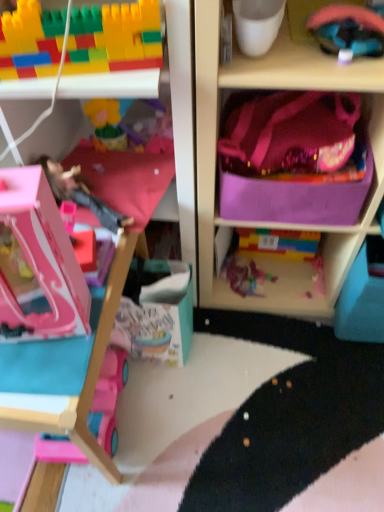
The height and width of the screenshot is (512, 384). What do you see at coordinates (42, 257) in the screenshot?
I see `pink plastic dollhouse at left` at bounding box center [42, 257].

At what (x,y) coordinates should I click in order to perform the action: click on purple fabric storage box at upper right. Please return your answer as a coordinate pair (x, y). Looking at the image, I should click on (299, 194).

What do you see at coordinates (244, 276) in the screenshot? The image size is (384, 512). I see `translucent plastic toy at center, acting as the second toy starting from the bottom` at bounding box center [244, 276].

Measure the distance between purple fabric bag at upper right and camera.

25.90 inches.

Locate an element on the screen. This screenshot has height=512, width=384. pink plastic dollhouse at left is located at coordinates (42, 257).

From the picture: Which object is positioned more to the right, purple fabric storage box at upper right or pink plastic toy car at lower left, the first toy positioned from the bottom?

From the viewer's perspective, purple fabric storage box at upper right appears more on the right side.

Is purple fabric storage box at upper right far away from pink plastic toy car at lower left, the first toy positioned from the bottom?

No, purple fabric storage box at upper right is in close proximity to pink plastic toy car at lower left, the first toy positioned from the bottom.

How far apart are purple fabric storage box at upper right and pink plastic toy car at lower left, the first toy positioned from the bottom?

57.99 centimeters.

Is purple fabric storage box at upper right aimed at pink plastic toy car at lower left, the first toy positioned from the bottom?

No, purple fabric storage box at upper right is not aimed at pink plastic toy car at lower left, the first toy positioned from the bottom.

From a real-world perspective, between white matte cup at upper center and multicolored plastic blocks at upper left, which is the second toy in top-to-bottom order, who is vertically lower?

In real-world perspective, white matte cup at upper center is lower.

Is white matte cup at upper center outside of multicolored plastic blocks at upper left, which is the second toy in top-to-bottom order?

Yes, white matte cup at upper center is located beyond the bounds of multicolored plastic blocks at upper left, which is the second toy in top-to-bottom order.

Is the position of white matte cup at upper center more distant than that of multicolored plastic blocks at upper left, which is the second toy in top-to-bottom order?

Yes, white matte cup at upper center is behind multicolored plastic blocks at upper left, which is the second toy in top-to-bottom order.

Between white matte cup at upper center and multicolored plastic blocks at upper left, the 4th toy positioned from the bottom, which one has smaller size?

Smaller between the two is white matte cup at upper center.

This screenshot has height=512, width=384. Identify the location of cabinetry behind the purple fabric bag at upper right. (42, 257).

Is point (275, 78) closer or farther from the camera than point (56, 251)?

Point (275, 78) appears to be farther away from the viewer than point (56, 251).

From a real-world perspective, between purple fabric bag at upper right and pink plastic dollhouse at left, who is vertically higher?

pink plastic dollhouse at left is physically above.

From the image's perspective, between translucent plastic toy at center, the 4th toy positioned from the top, and multicolored plastic blocks at upper left, which is the second toy in top-to-bottom order, which one is located above?

multicolored plastic blocks at upper left, which is the second toy in top-to-bottom order, appears higher in the image.

Is translucent plastic toy at center, acting as the second toy starting from the bottom, spatially inside multicolored plastic blocks at upper left, the 4th toy positioned from the bottom, or outside of it?

translucent plastic toy at center, acting as the second toy starting from the bottom, is spatially situated outside multicolored plastic blocks at upper left, the 4th toy positioned from the bottom.

Is point (246, 295) less distant than point (1, 18)?

No, (246, 295) is further to viewer.

Are translucent plastic toy at center, the 4th toy positioned from the top, and multicolored plastic blocks at upper left, which is the second toy in top-to-bottom order, located far from each other?

They are positioned close to each other.

Based on the photo, is purple fabric storage box at upper right turned away from rubberized pink helmet at upper right, marked as the 5th toy in a bottom-to-top arrangement?

No, purple fabric storage box at upper right's orientation is not away from rubberized pink helmet at upper right, marked as the 5th toy in a bottom-to-top arrangement.

Is purple fabric storage box at upper right positioned far away from rubberized pink helmet at upper right, marked as the 5th toy in a bottom-to-top arrangement?

Actually, purple fabric storage box at upper right and rubberized pink helmet at upper right, marked as the 5th toy in a bottom-to-top arrangement, are a little close together.

Considering the relative sizes of purple fabric storage box at upper right and rubberized pink helmet at upper right, marked as the 5th toy in a bottom-to-top arrangement, in the image provided, is purple fabric storage box at upper right bigger than rubberized pink helmet at upper right, marked as the 5th toy in a bottom-to-top arrangement,?

Indeed, purple fabric storage box at upper right has a larger size compared to rubberized pink helmet at upper right, marked as the 5th toy in a bottom-to-top arrangement.

Does translucent plastic toy at center, the 4th toy positioned from the top, have a smaller size compared to purple fabric storage box at upper right?

Yes.

At what (x,y) coordinates should I click in order to perform the action: click on the 1st toy to the left when counting from the purple fabric storage box at upper right. Please return your answer as a coordinate pair (x, y). Looking at the image, I should click on (244, 276).

Is translucent plastic toy at center, the 4th toy positioned from the top, positioned beyond the bounds of purple fabric storage box at upper right?

Yes.

From the image's perspective, between translucent plastic toy at center, the 4th toy positioned from the top, and purple fabric storage box at upper right, which one is located above?

purple fabric storage box at upper right is shown above in the image.

Is pink plastic toy car at lower left, the fifth toy when ordered from top to bottom, placed right next to purple fabric bag at upper right?

pink plastic toy car at lower left, the fifth toy when ordered from top to bottom, and purple fabric bag at upper right are not in contact.

Where is `shelf on the right of pink plastic toy car at lower left, the fifth toy when ordered from top to bottom`? This screenshot has width=384, height=512. shelf on the right of pink plastic toy car at lower left, the fifth toy when ordered from top to bottom is located at coordinates (278, 224).

From the picture: Which of these two, pink plastic toy car at lower left, the fifth toy when ordered from top to bottom, or purple fabric bag at upper right, stands shorter?

With less height is pink plastic toy car at lower left, the fifth toy when ordered from top to bottom.

Is pink plastic toy car at lower left, the fifth toy when ordered from top to bottom, at the left side of purple fabric bag at upper right?

Yes, pink plastic toy car at lower left, the fifth toy when ordered from top to bottom, is to the left of purple fabric bag at upper right.

Where is `the 1st toy directly beneath the purple fabric storage box at upper right (from a real-world perspective)`? The image size is (384, 512). the 1st toy directly beneath the purple fabric storage box at upper right (from a real-world perspective) is located at coordinates (108, 398).

At what (x,y) coordinates should I click in order to perform the action: click on coffee cup above the multicolored plastic blocks at upper left, the 4th toy positioned from the bottom (from the image's perspective). Please return your answer as a coordinate pair (x, y). This screenshot has width=384, height=512. Looking at the image, I should click on (257, 24).

Looking at the image, which one is located further to rubberized pink helmet at upper right, which is the first toy from top to bottom, pink plastic dollhouse at left, which appears as the 3th toy when viewed from the top, or pink fabric pillow at center?

The object further to rubberized pink helmet at upper right, which is the first toy from top to bottom, is pink plastic dollhouse at left, which appears as the 3th toy when viewed from the top.

Which object lies nearer to the anchor point purple fabric bag at upper right, pink plastic toy car at lower left, the first toy positioned from the bottom, or purple fabric storage box at upper right?

The object closer to purple fabric bag at upper right is purple fabric storage box at upper right.

Based on their spatial positions, is white matte cup at upper center or purple fabric storage box at upper right further from purple fabric bag at upper right?

white matte cup at upper center is further to purple fabric bag at upper right.

Which object lies nearer to the anchor point pink fabric pillow at center, rubberized pink helmet at upper right, marked as the 5th toy in a bottom-to-top arrangement, or purple fabric bag at upper right?

purple fabric bag at upper right lies closer to pink fabric pillow at center than the other object.

From the image, which object appears to be farther from pink plastic toy car at lower left, the fifth toy when ordered from top to bottom, purple fabric bag at upper right or rubberized pink helmet at upper right, which is the first toy from top to bottom?

Among the two, rubberized pink helmet at upper right, which is the first toy from top to bottom, is located further to pink plastic toy car at lower left, the fifth toy when ordered from top to bottom.

When comparing their distances from purple fabric bag at upper right, does white matte cup at upper center or pink plastic toy car at lower left, the first toy positioned from the bottom, seem closer?

white matte cup at upper center is closer to purple fabric bag at upper right.

Based on the photo, estimate the real-world distances between objects in this image. Which object is further from purple fabric bag at upper right, pink plastic dollhouse at left or pink plastic toy car at lower left, the first toy positioned from the bottom?

pink plastic toy car at lower left, the first toy positioned from the bottom, lies further to purple fabric bag at upper right than the other object.

Considering their positions, is pink plastic dollhouse at left, which appears as the 3th toy when viewed from the top, positioned further to purple fabric storage box at upper right than white matte cup at upper center?

Among the two, pink plastic dollhouse at left, which appears as the 3th toy when viewed from the top, is located further to purple fabric storage box at upper right.

Locate an element on the screen. The height and width of the screenshot is (512, 384). storage box situated between pink plastic dollhouse at left and purple fabric bag at upper right from left to right is located at coordinates (299, 194).

You are a GUI agent. You are given a task and a screenshot of the screen. Output one action in this format:
    pyautogui.click(x=<x>, y=<y>)
    Task: Click on the storage box between multicolored plastic blocks at upper left, the 4th toy positioned from the bottom, and pink plastic toy car at lower left, the fifth toy when ordered from top to bottom, in the up-down direction
    
    Given the screenshot: What is the action you would take?
    pyautogui.click(x=299, y=194)

Identify the location of coffee cup between pink plastic dollhouse at left and purple fabric bag at upper right from left to right. Image resolution: width=384 pixels, height=512 pixels. (257, 24).

Identify the location of cabinetry located between multicolored plastic blocks at upper left, which is the second toy in top-to-bottom order, and translucent plastic toy at center, the 4th toy positioned from the top, in the depth direction. (42, 257).